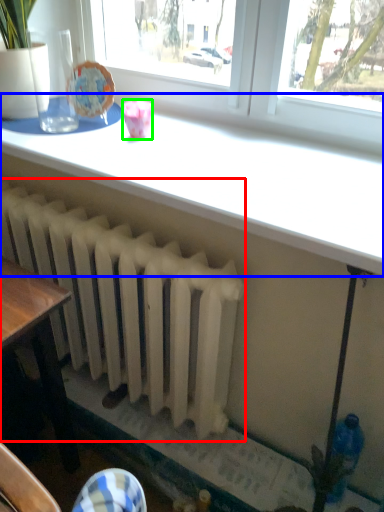
Question: Which is farther away from radiator (highlighted by a red box)? table (highlighted by a blue box) or tableware (highlighted by a green box)?

Choices:
 (A) table
 (B) tableware

Answer: (B)